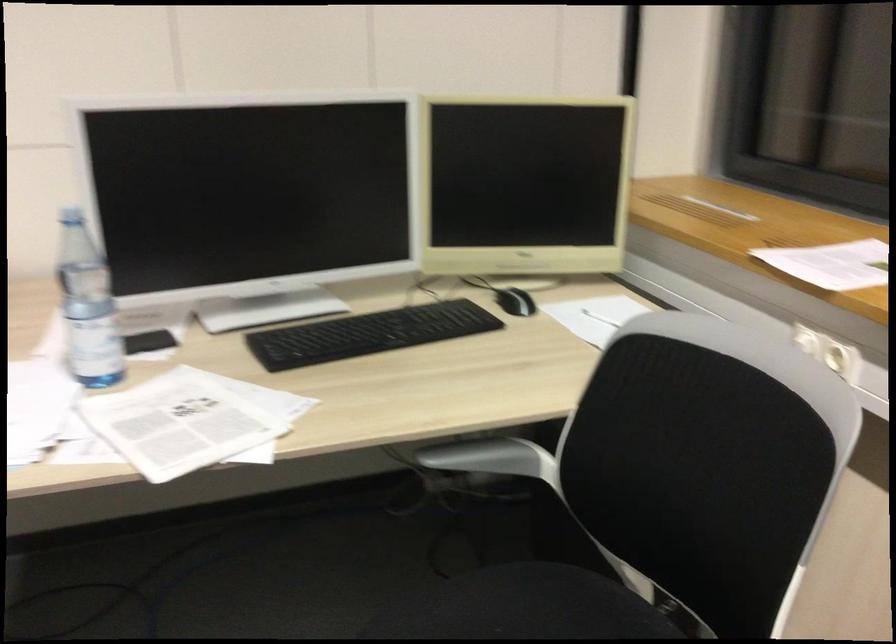
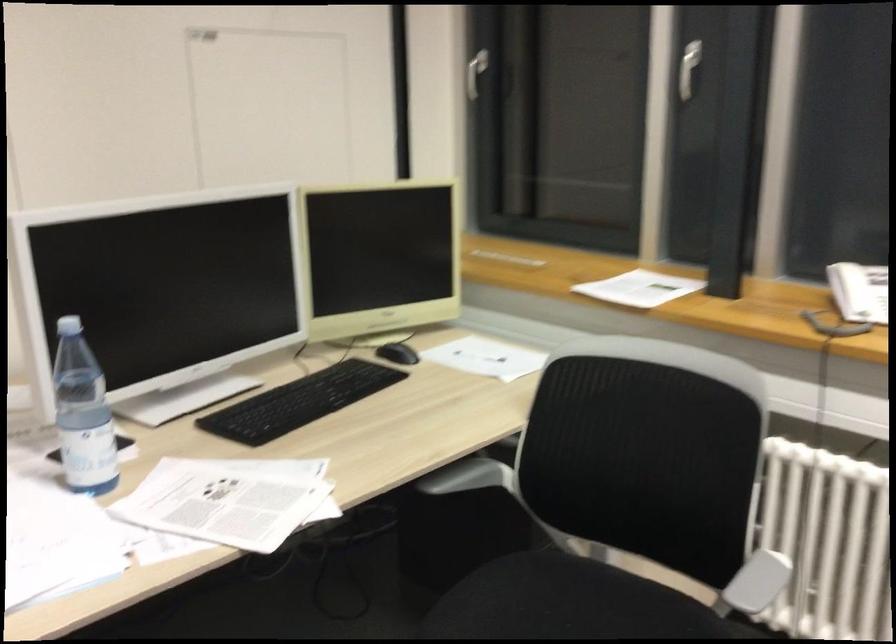
In the second image, find the point that corresponds to the point at 513,299 in the first image.

(398, 353)